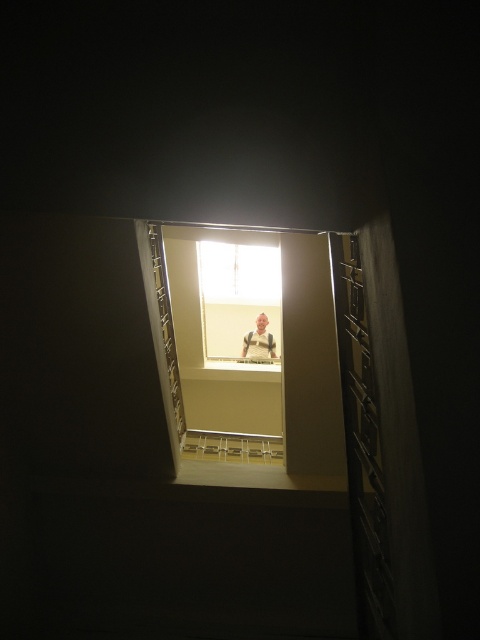
Does clear glass window at center have a larger size compared to white plastic stair at center?

Yes, clear glass window at center is bigger than white plastic stair at center.

Is clear glass window at center thinner than white plastic stair at center?

No.

Who is more distant from viewer, (277, 284) or (273, 451)?

The point (277, 284) is more distant.

Identify the location of clear glass window at center. The image size is (480, 640). (240, 298).

Who is taller, clear glass window at center or smooth beige shirt at center?

Standing taller between the two is clear glass window at center.

Can you confirm if clear glass window at center is positioned to the right of smooth beige shirt at center?

In fact, clear glass window at center is to the left of smooth beige shirt at center.

Does point (203, 259) come in front of point (255, 355)?

That is True.

At what (x,y) coordinates should I click in order to perform the action: click on clear glass window at center. Please return your answer as a coordinate pair (x, y). The image size is (480, 640). Looking at the image, I should click on (240, 298).

Between white plastic stair at center and smooth beige shirt at center, which one has more height?

smooth beige shirt at center is taller.

How far apart are white plastic stair at center and smooth beige shirt at center?

The distance of white plastic stair at center from smooth beige shirt at center is 9.97 feet.

Is point (217, 451) closer to camera compared to point (263, 326)?

Yes.

This screenshot has width=480, height=640. I want to click on white plastic stair at center, so click(x=231, y=445).